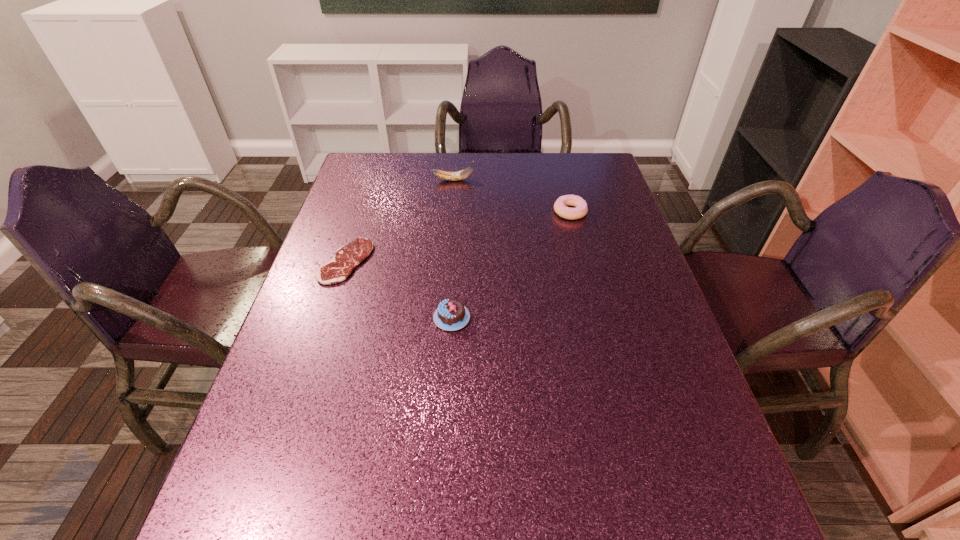
Choose which object is the nearest neighbor to the leftmost object. Please provide its 2D coordinates. Your answer should be formatted as a tuple, i.e. [(x, y)], where the tuple contains the x and y coordinates of a point satisfying the conditions above.

[(451, 314)]

Identify which object is located as the nearest to the tallest object. Please provide its 2D coordinates. Your answer should be formatted as a tuple, i.e. [(x, y)], where the tuple contains the x and y coordinates of a point satisfying the conditions above.

[(560, 208)]

Locate an element on the screen. This screenshot has height=540, width=960. free space that satisfies the following two spatial constraints: 1. on the back side of the chocolate cake; 2. on the peel of the banana is located at coordinates (460, 180).

Where is `vacant point that satisfies the following two spatial constraints: 1. on the back side of the third tallest object; 2. on the left side of the leftmost object`? Image resolution: width=960 pixels, height=540 pixels. vacant point that satisfies the following two spatial constraints: 1. on the back side of the third tallest object; 2. on the left side of the leftmost object is located at coordinates (362, 212).

Image resolution: width=960 pixels, height=540 pixels. What are the coordinates of `free spot that satisfies the following two spatial constraints: 1. on the peel of the banana; 2. on the left side of the third tallest object` in the screenshot? It's located at (x=451, y=212).

I want to click on vacant space that satisfies the following two spatial constraints: 1. on the peel of the doughnut; 2. on the left side of the banana, so click(x=451, y=212).

Locate an element on the screen. vacant area that satisfies the following two spatial constraints: 1. on the back side of the nearest object; 2. on the peel of the farthest object is located at coordinates (460, 180).

Image resolution: width=960 pixels, height=540 pixels. I want to click on vacant space that satisfies the following two spatial constraints: 1. on the peel of the doughnut; 2. on the left side of the banana, so click(451, 212).